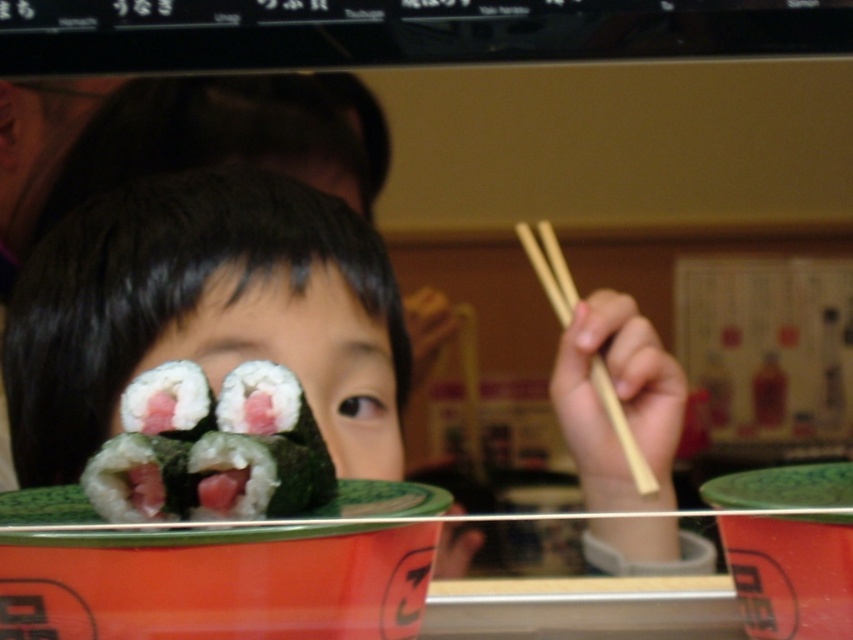
Question: Which is farther from the wooden chopsticks at right?

Choices:
 (A) green rice with seaweed at center
 (B) green matte sushi at center
 (C) green seaweed wrapped sushi at center

Answer: (A)

Question: Where is green seaweed wrapped sushi at center located in relation to wooden chopsticks at right in the image?

Choices:
 (A) left
 (B) right

Answer: (A)

Question: Is green seaweed wrapped sushi at center closer to the viewer compared to wooden chopsticks at right?

Choices:
 (A) yes
 (B) no

Answer: (A)

Question: Among these objects, which one is farthest from the camera?

Choices:
 (A) green rice with seaweed at center
 (B) green matte sushi at center
 (C) wooden chopsticks at right
 (D) green seaweed wrapped sushi at center

Answer: (B)

Question: Which of the following is the farthest from the observer?

Choices:
 (A) (596, 362)
 (B) (259, 442)
 (C) (160, 413)

Answer: (A)

Question: In this image, where is green seaweed wrapped sushi at center located relative to green rice with seaweed at center?

Choices:
 (A) left
 (B) right

Answer: (B)